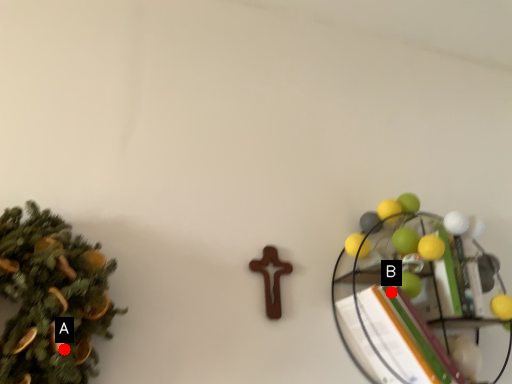
Question: Two points are circled on the image, labeled by A and B beside each circle. Which point is closer to the camera?

Choices:
 (A) A is closer
 (B) B is closer

Answer: (A)